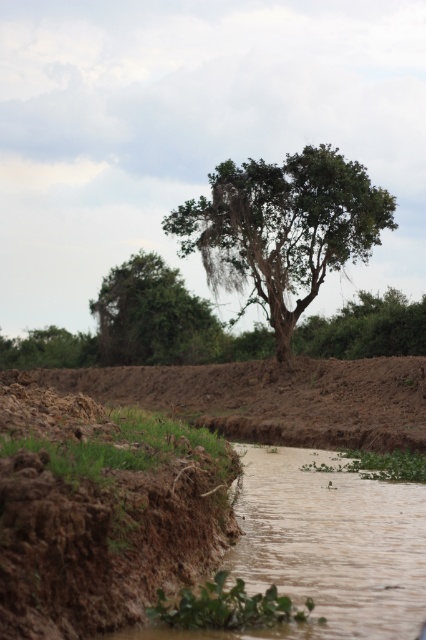
Question: Estimate the real-world distances between objects in this image. Which object is farther from the brown muddy field at center?

Choices:
 (A) green leafy tree at center
 (B) green leafy tree at lower left
 (C) green leafy tree at upper center

Answer: (B)

Question: Is brown muddy field at center positioned behind green leafy tree at upper center?

Choices:
 (A) yes
 (B) no

Answer: (B)

Question: Where is green leafy tree at upper center located in relation to green leafy tree at lower left in the image?

Choices:
 (A) above
 (B) below

Answer: (A)

Question: Which of these objects is positioned closest to the green leafy tree at upper center?

Choices:
 (A) green leafy tree at lower left
 (B) brown muddy field at center
 (C) green leafy tree at center

Answer: (A)

Question: Is green leafy tree at center closer to the viewer compared to brown muddy field at center?

Choices:
 (A) no
 (B) yes

Answer: (A)

Question: Which of the following is the closest to the observer?

Choices:
 (A) (385, 449)
 (B) (282, 230)

Answer: (A)